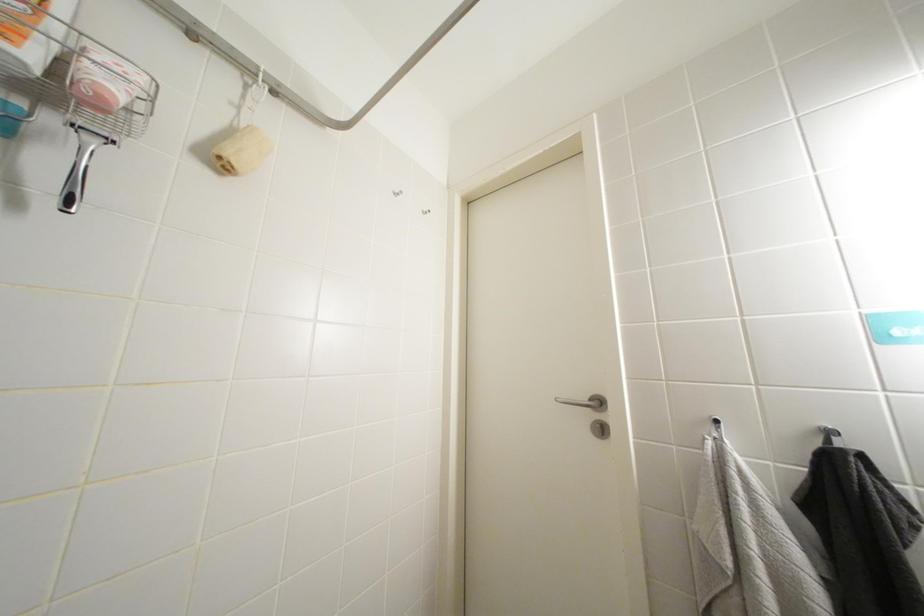
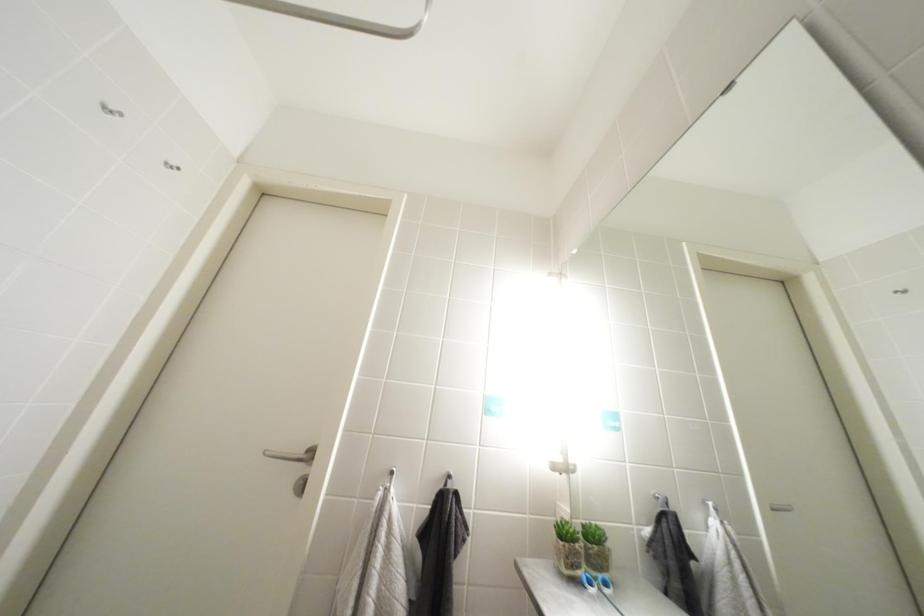
Question: The camera is either moving clockwise (left) or counter-clockwise (right) around the object. The first image is from the beginning of the video and the second image is from the end. Is the camera moving left or right when shooting the video?

Choices:
 (A) Left
 (B) Right

Answer: (A)